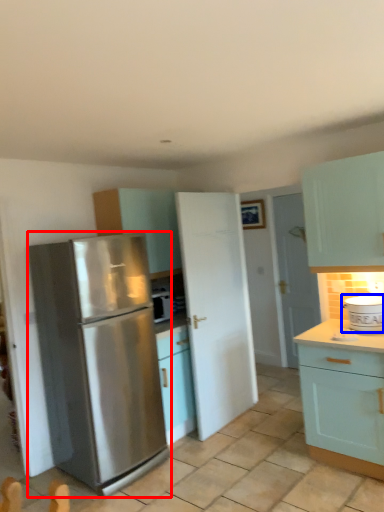
Question: Which point is closer to the camera, refrigerator (highlighted by a red box) or appliance (highlighted by a blue box)?

Choices:
 (A) refrigerator
 (B) appliance

Answer: (A)